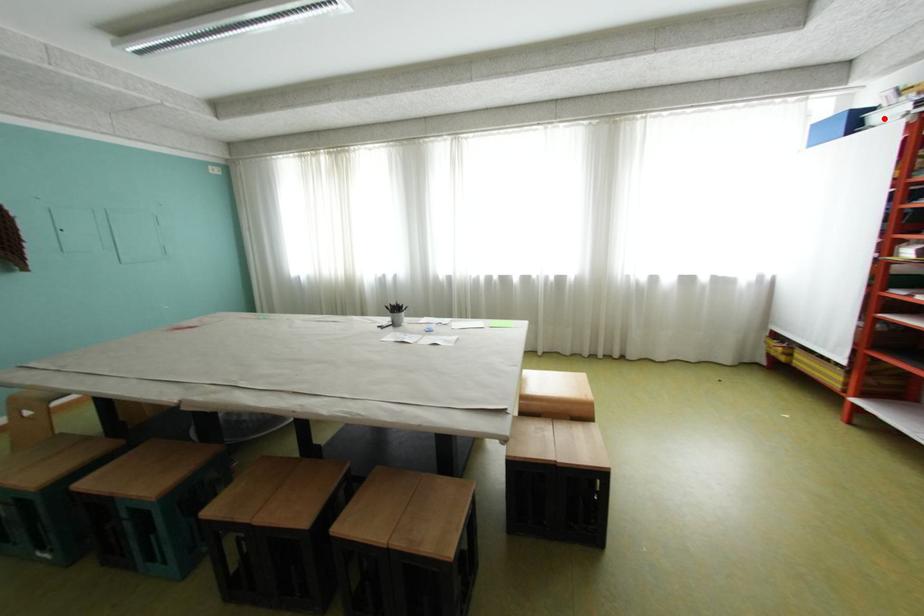
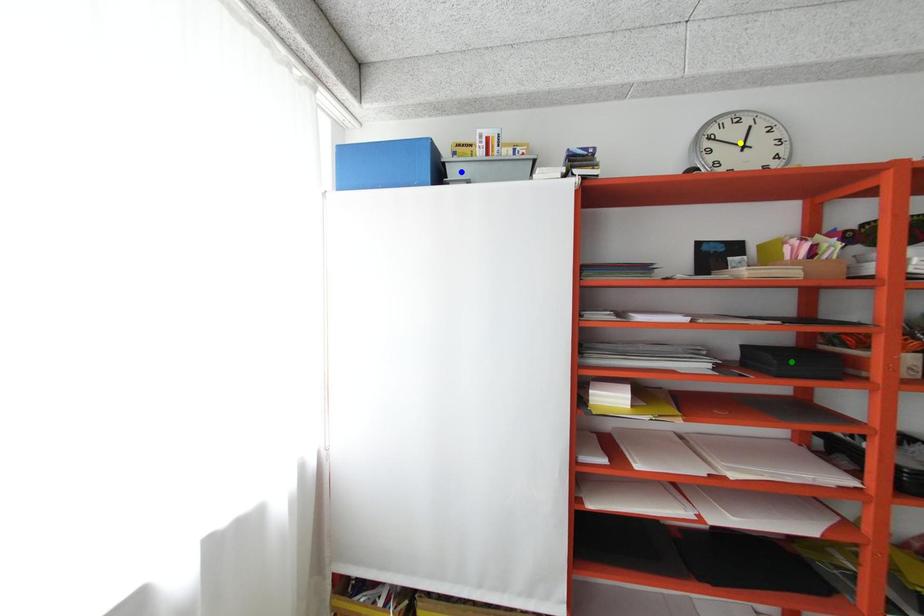
Question: I am providing you with two images of the same scene from different viewpoints. A red point is marked on the first image. You are given multiple points on the second image. In image 2, which mark is for the same physical point as the one in image 1?

Choices:
 (A) yellow point
 (B) blue point
 (C) green point

Answer: (B)